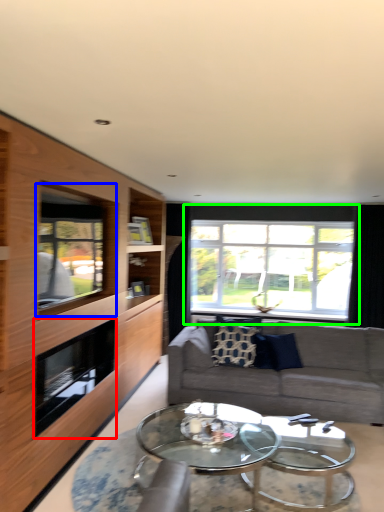
Question: Estimate the real-world distances between objects in this image. Which object is closer to fireplace (highlighted by a red box), window (highlighted by a blue box) or window (highlighted by a green box)?

Choices:
 (A) window
 (B) window

Answer: (A)